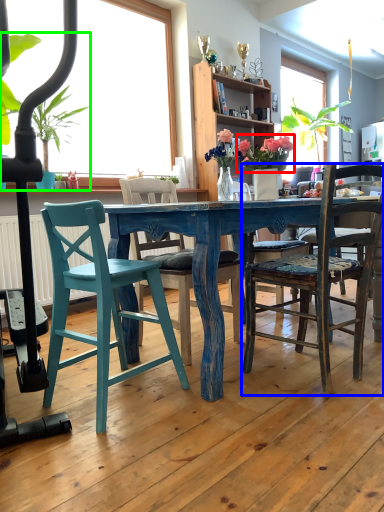
Question: Which is nearer to the floral arrangement (highlighted by a red box)? chair (highlighted by a blue box) or houseplant (highlighted by a green box).

Choices:
 (A) chair
 (B) houseplant

Answer: (A)